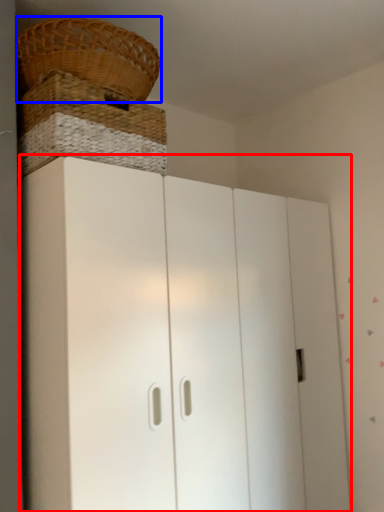
Question: Which object appears farthest to the camera in this image, cupboard (highlighted by a red box) or basket (highlighted by a blue box)?

Choices:
 (A) cupboard
 (B) basket

Answer: (B)